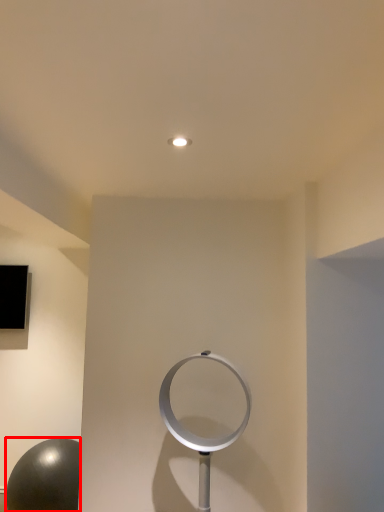
Question: Where is ball (annotated by the red box) located in relation to circle in the image?

Choices:
 (A) right
 (B) left

Answer: (B)